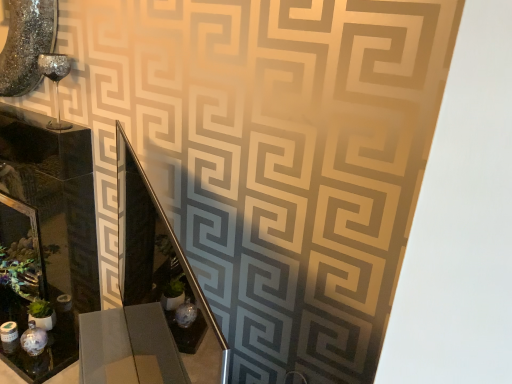
Question: Considering the relative sizes of metallic silver vanity at center and matte black glass box at left in the image provided, is metallic silver vanity at center taller than matte black glass box at left?

Choices:
 (A) yes
 (B) no

Answer: (B)

Question: From the image's perspective, does metallic silver vanity at center appear lower than matte black glass box at left?

Choices:
 (A) yes
 (B) no

Answer: (A)

Question: Does metallic silver vanity at center appear on the left side of matte black glass box at left?

Choices:
 (A) no
 (B) yes

Answer: (A)

Question: Could you tell me if metallic silver vanity at center is facing matte black glass box at left?

Choices:
 (A) yes
 (B) no

Answer: (B)

Question: Is metallic silver vanity at center touching matte black glass box at left?

Choices:
 (A) no
 (B) yes

Answer: (A)

Question: In the image, is matte glass picture frame at lower left positioned in front of or behind metallic silver vanity at center?

Choices:
 (A) front
 (B) behind

Answer: (B)

Question: Considering the positions of matte glass picture frame at lower left and metallic silver vanity at center in the image, is matte glass picture frame at lower left taller or shorter than metallic silver vanity at center?

Choices:
 (A) short
 (B) tall

Answer: (A)

Question: Based on their sizes in the image, would you say matte glass picture frame at lower left is bigger or smaller than metallic silver vanity at center?

Choices:
 (A) big
 (B) small

Answer: (B)

Question: Looking at their shapes, would you say matte glass picture frame at lower left is wider or thinner than metallic silver vanity at center?

Choices:
 (A) wide
 (B) thin

Answer: (A)

Question: Is metallic silver vanity at center wider or thinner than matte glass picture frame at lower left?

Choices:
 (A) thin
 (B) wide

Answer: (A)

Question: Considering the positions of metallic silver vanity at center and matte glass picture frame at lower left in the image, is metallic silver vanity at center bigger or smaller than matte glass picture frame at lower left?

Choices:
 (A) big
 (B) small

Answer: (A)

Question: Is metallic silver vanity at center inside the boundaries of matte glass picture frame at lower left, or outside?

Choices:
 (A) outside
 (B) inside

Answer: (A)

Question: From the image's perspective, relative to matte glass picture frame at lower left, is metallic silver vanity at center above or below?

Choices:
 (A) below
 (B) above

Answer: (B)

Question: Looking at the image, does matte glass picture frame at lower left seem bigger or smaller compared to matte black glass box at left?

Choices:
 (A) big
 (B) small

Answer: (B)

Question: Is matte glass picture frame at lower left to the left or to the right of matte black glass box at left in the image?

Choices:
 (A) left
 (B) right

Answer: (A)